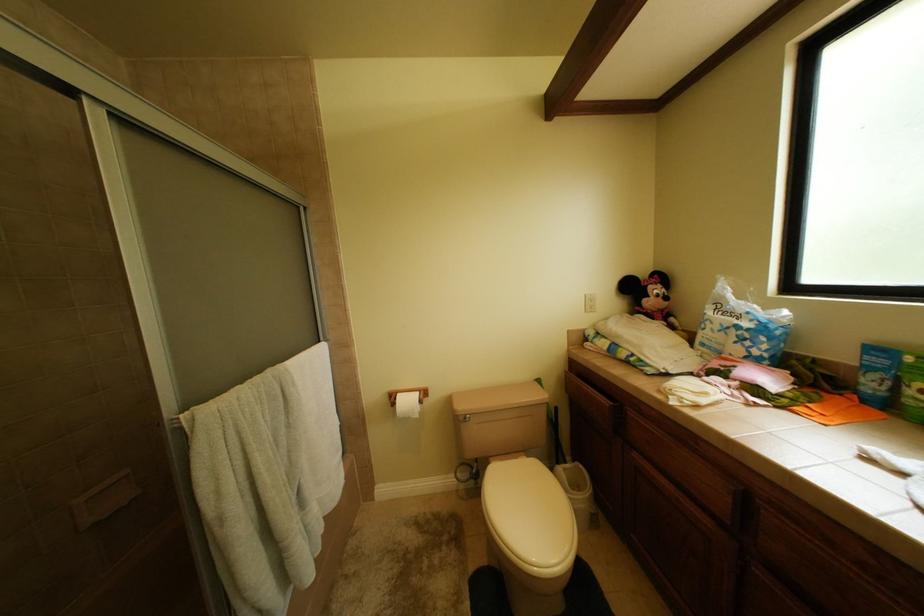
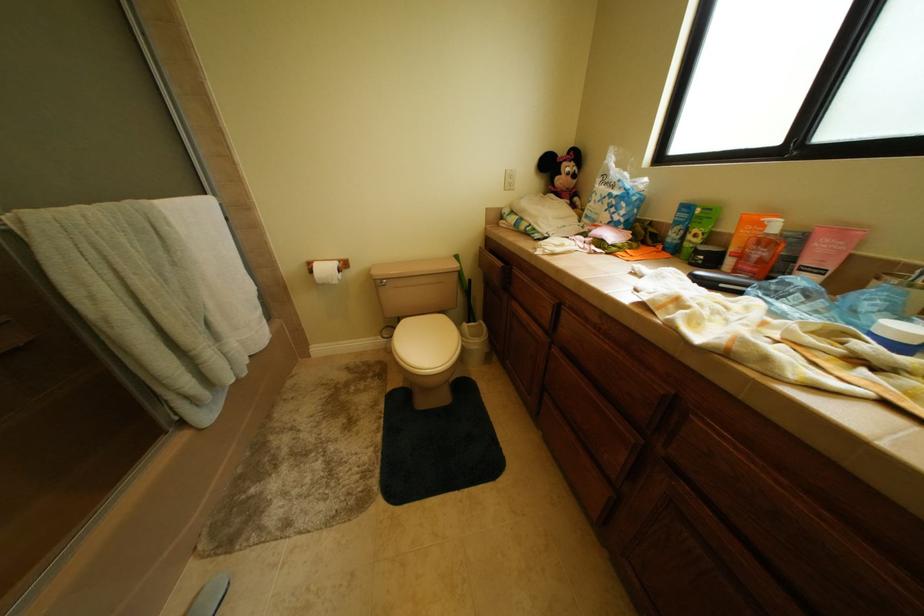
In a continuous first-person perspective shot, in which direction is the camera moving?

The movement direction of the cameraman is right, backward.